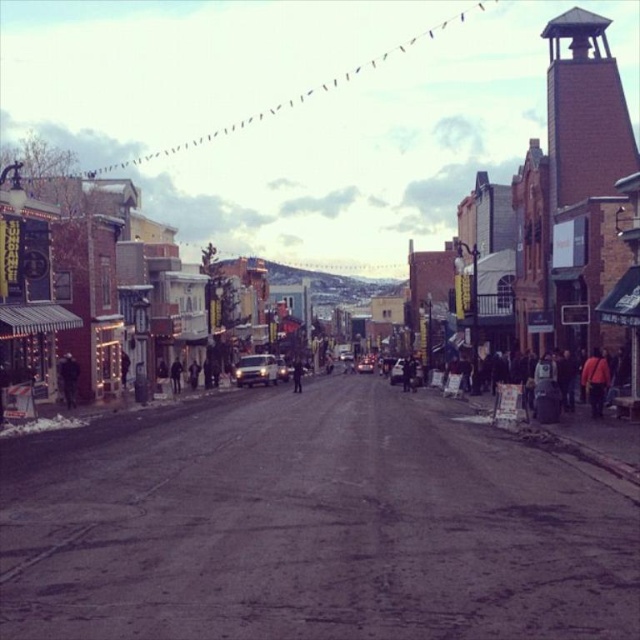
Question: Which point is farther to the camera?

Choices:
 (A) metallic silver car at center
 (B) orange fabric jacket at right
 (C) metallic silver sedan at center

Answer: (C)

Question: Where is matte brick building at center located in relation to silver metallic car at center in the image?

Choices:
 (A) below
 (B) above

Answer: (B)

Question: Does dark gray fabric crowd at center right appear on the left side of dark gray jacket at center?

Choices:
 (A) yes
 (B) no

Answer: (B)

Question: Which point appears closest to the camera in this image?

Choices:
 (A) (586, 390)
 (B) (300, 385)
 (C) (586, 381)
 (D) (413, 381)

Answer: (C)

Question: Is dark gray fabric crowd at center right to the left of black leather jacket at left from the viewer's perspective?

Choices:
 (A) yes
 (B) no

Answer: (B)

Question: Which point appears closest to the camera in this image?

Choices:
 (A) (176, 365)
 (B) (600, 369)

Answer: (B)